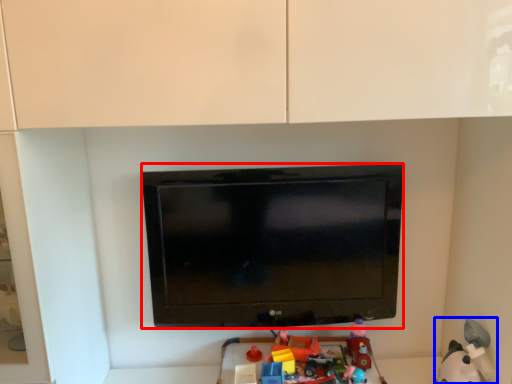
Question: Which object is closer to the camera taking this photo, television (highlighted by a red box) or toy (highlighted by a blue box)?

Choices:
 (A) television
 (B) toy

Answer: (B)